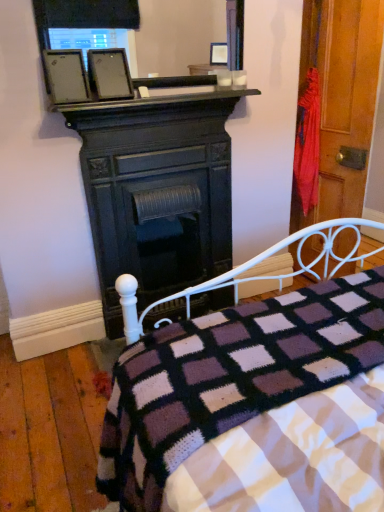
Question: Considering the relative sizes of matte black picture frame at upper center and matte black fireplace at center in the image provided, is matte black picture frame at upper center thinner than matte black fireplace at center?

Choices:
 (A) no
 (B) yes

Answer: (B)

Question: Is matte black fireplace at center located within matte black picture frame at upper center?

Choices:
 (A) yes
 (B) no

Answer: (B)

Question: Is the position of matte black picture frame at upper center less distant than that of matte black fireplace at center?

Choices:
 (A) no
 (B) yes

Answer: (B)

Question: From the image's perspective, does matte black picture frame at upper center appear higher than matte black fireplace at center?

Choices:
 (A) no
 (B) yes

Answer: (B)

Question: Considering the relative sizes of matte black picture frame at upper center and matte black fireplace at center in the image provided, is matte black picture frame at upper center wider than matte black fireplace at center?

Choices:
 (A) no
 (B) yes

Answer: (A)

Question: Is the depth of matte black picture frame at upper center greater than that of matte black fireplace at center?

Choices:
 (A) no
 (B) yes

Answer: (A)

Question: From a real-world perspective, is wooden door at right under matte black fireplace at center?

Choices:
 (A) yes
 (B) no

Answer: (B)

Question: Is wooden door at right positioned with its back to matte black fireplace at center?

Choices:
 (A) yes
 (B) no

Answer: (A)

Question: From a real-world perspective, is wooden door at right located higher than matte black fireplace at center?

Choices:
 (A) no
 (B) yes

Answer: (B)

Question: Is wooden door at right outside of matte black fireplace at center?

Choices:
 (A) no
 (B) yes

Answer: (B)

Question: Can you see wooden door at right touching matte black fireplace at center?

Choices:
 (A) no
 (B) yes

Answer: (A)

Question: Does wooden door at right appear on the left side of matte black fireplace at center?

Choices:
 (A) no
 (B) yes

Answer: (A)

Question: From the image's perspective, would you say knitted woolen blanket at lower center is shown under black matte fireplace at upper center?

Choices:
 (A) no
 (B) yes

Answer: (B)